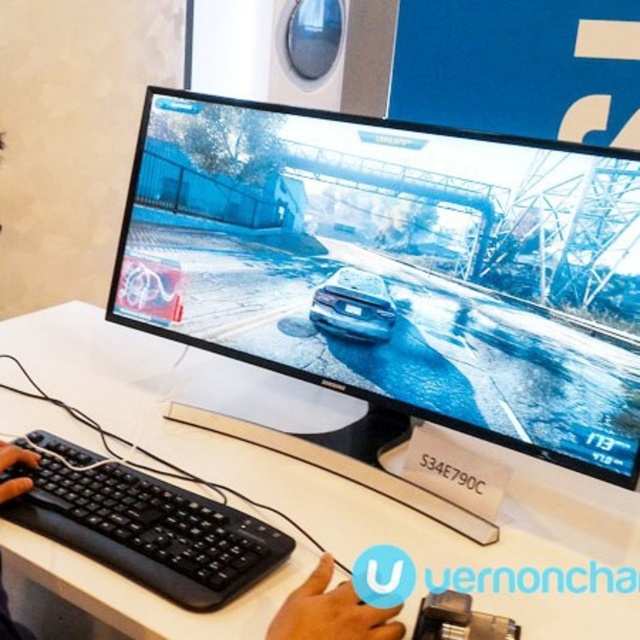
Question: Which point is closer to the camera taking this photo?

Choices:
 (A) (480, 429)
 (B) (250, 541)

Answer: (B)

Question: Is satin black monitor at center to the right of black plastic keyboard at lower left from the viewer's perspective?

Choices:
 (A) yes
 (B) no

Answer: (A)

Question: Does white plastic computer desk at center appear over black plastic keyboard at lower left?

Choices:
 (A) no
 (B) yes

Answer: (B)

Question: Among these objects, which one is nearest to the camera?

Choices:
 (A) satin black monitor at center
 (B) black plastic keyboard at lower left
 (C) white plastic computer desk at center

Answer: (C)

Question: Which point is closer to the camera?

Choices:
 (A) satin black monitor at center
 (B) white plastic computer desk at center
 (C) black plastic keyboard at lower left

Answer: (B)

Question: Can you confirm if white plastic computer desk at center is thinner than black plastic keyboard at lower left?

Choices:
 (A) yes
 (B) no

Answer: (B)